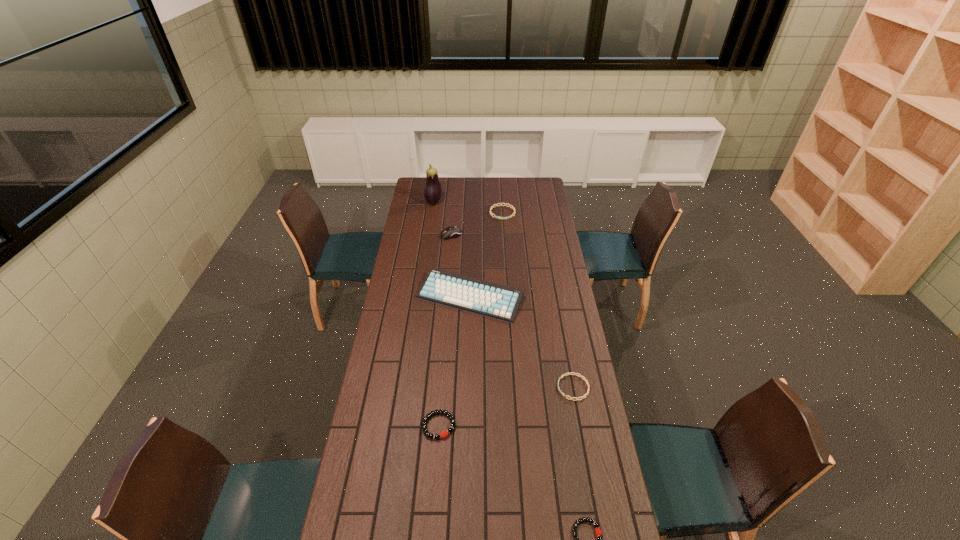
Image resolution: width=960 pixels, height=540 pixels. Identify the location of eggplant. (432, 193).

This screenshot has height=540, width=960. Find the location of `black computer mouse`. black computer mouse is located at coordinates (453, 231).

Locate an element on the screen. The height and width of the screenshot is (540, 960). computer mouse is located at coordinates (453, 231).

Locate an element on the screen. The width and height of the screenshot is (960, 540). computer keyboard is located at coordinates (498, 301).

Identify the location of the fourth nearest object. (498, 301).

Where is `the farther blue bracelet`? This screenshot has height=540, width=960. the farther blue bracelet is located at coordinates (492, 207).

Identify the location of the bigger blue bracelet. The height and width of the screenshot is (540, 960). (492, 207).

Where is `the farther black bracelet`? This screenshot has width=960, height=540. the farther black bracelet is located at coordinates (443, 434).

The image size is (960, 540). Find the location of `the bigger black bracelet`. the bigger black bracelet is located at coordinates (443, 434).

At what (x,y) coordinates should I click in order to perform the action: click on the nearer blue bracelet. Please return your answer as a coordinate pair (x, y). This screenshot has width=960, height=540. Looking at the image, I should click on (563, 375).